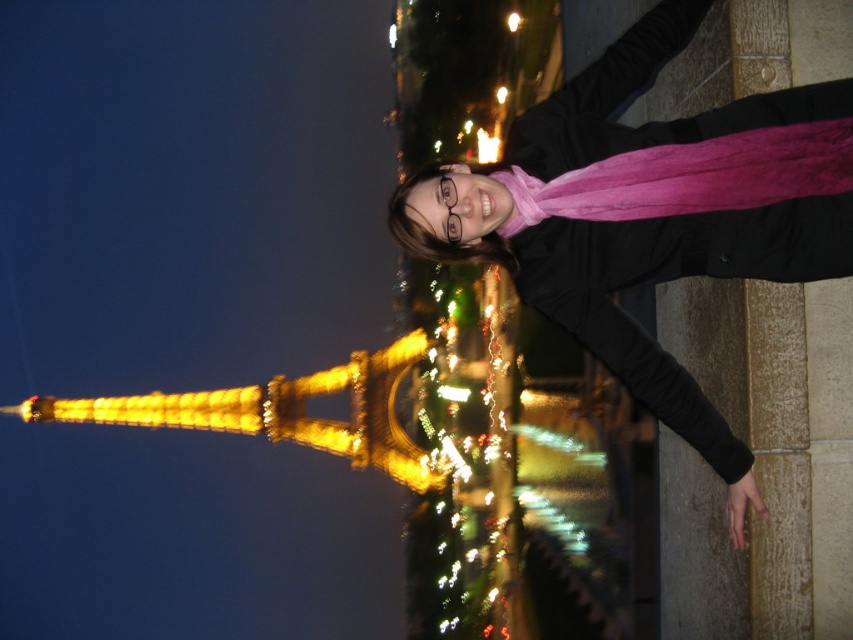
Does point (799, 212) come farther from viewer compared to point (376, 445)?

No, (799, 212) is closer to viewer.

Who is lower down, pink velvet scarf at upper right or golden illuminated tower at left?

golden illuminated tower at left

Which is in front, point (810, 236) or point (347, 378)?

Point (810, 236) is more forward.

This screenshot has width=853, height=640. Identify the location of pink velvet scarf at upper right. (631, 280).

Is pink velvet scarf at upper right above golden illuminated eiffel tower at center?

Indeed, pink velvet scarf at upper right is positioned over golden illuminated eiffel tower at center.

Between pink velvet scarf at upper right and golden illuminated eiffel tower at center, which one appears on the left side from the viewer's perspective?

From the viewer's perspective, golden illuminated eiffel tower at center appears more on the left side.

What do you see at coordinates (631, 280) in the screenshot? This screenshot has width=853, height=640. I see `pink velvet scarf at upper right` at bounding box center [631, 280].

Identify the location of pink velvet scarf at upper right. (631, 280).

Which is more to the right, golden illuminated eiffel tower at center or golden illuminated tower at left?

From the viewer's perspective, golden illuminated eiffel tower at center appears more on the right side.

Is golden illuminated eiffel tower at center behind golden illuminated tower at left?

No, it is not.

Which is in front, point (477, 346) or point (61, 401)?

Point (477, 346) is more forward.

At what (x,y) coordinates should I click in order to perform the action: click on golden illuminated eiffel tower at center. Please return your answer as a coordinate pair (x, y). Looking at the image, I should click on (461, 452).